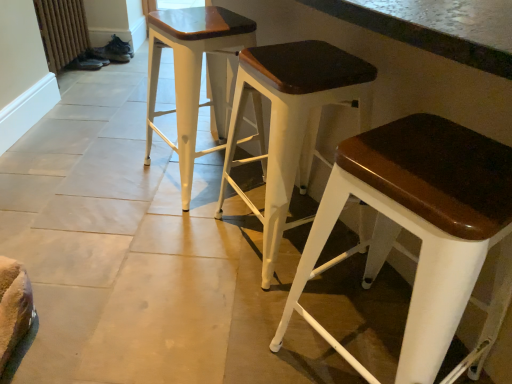
The image size is (512, 384). Find the location of `empty space that is ontop of white wood stool at center, the 3th stool in the left-to-right sequence`. empty space that is ontop of white wood stool at center, the 3th stool in the left-to-right sequence is located at coordinates (436, 157).